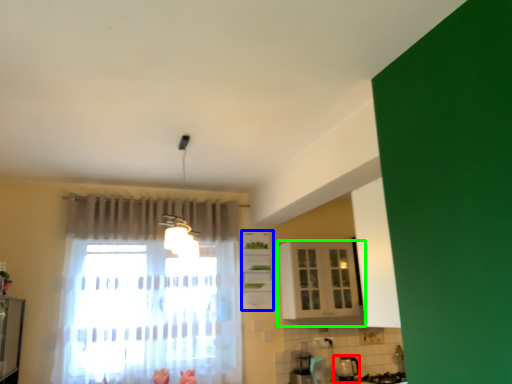
Question: Which object is positioned farthest from appliance (highlighted by a red box)? Select from cabinetry (highlighted by a blue box) and cabinetry (highlighted by a green box).

Choices:
 (A) cabinetry
 (B) cabinetry

Answer: (A)